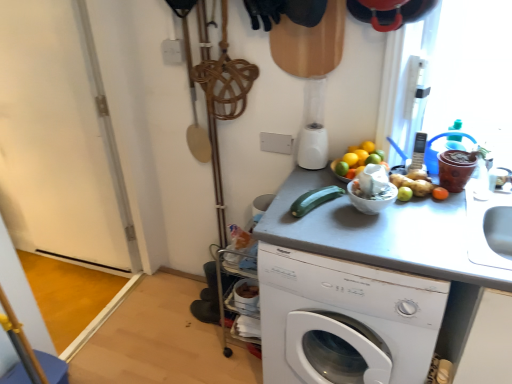
Locate an element on the screen. Image resolution: width=512 pixels, height=384 pixels. free location in front of orange matte at upper right is located at coordinates coord(349,200).